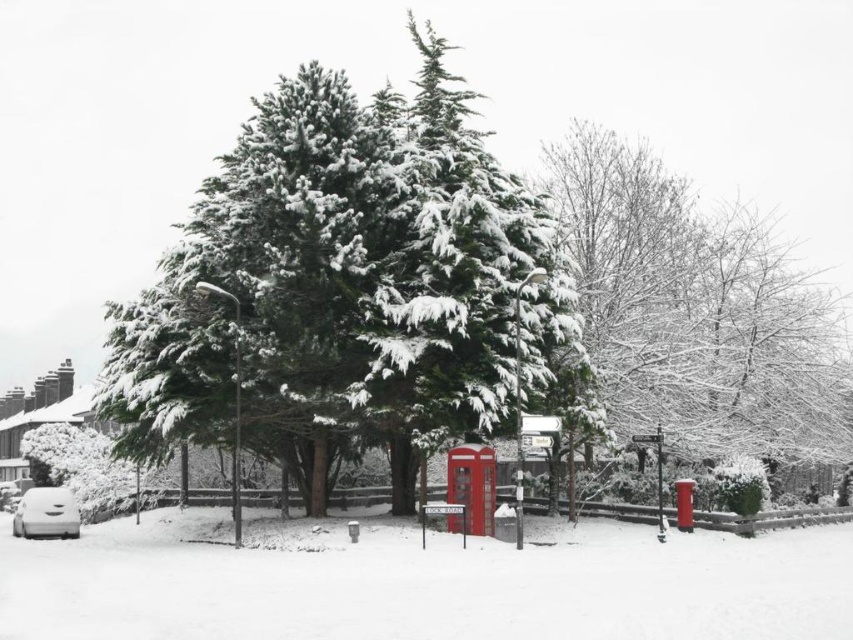
Is green textured tree at center shorter than snow-covered evergreen tree at center?

Indeed, green textured tree at center has a lesser height compared to snow-covered evergreen tree at center.

Between green textured tree at center and snow-covered evergreen tree at center, which one appears on the right side from the viewer's perspective?

Positioned to the right is snow-covered evergreen tree at center.

Identify the location of green textured tree at center. The width and height of the screenshot is (853, 640). (349, 288).

Which of these two, snow-covered evergreen tree at center or metallic red phone box at center, stands taller?

Standing taller between the two is snow-covered evergreen tree at center.

Which is more to the right, snow-covered evergreen tree at center or metallic red phone box at center?

snow-covered evergreen tree at center is more to the right.

Is point (628, 186) closer to viewer compared to point (451, 520)?

That is False.

The height and width of the screenshot is (640, 853). I want to click on snow-covered evergreen tree at center, so click(x=695, y=308).

Measure the distance between white fluffy snow at lower center and camera.

The distance of white fluffy snow at lower center from camera is 30.52 feet.

Who is taller, white fluffy snow at lower center or metallic red phone box at center?

white fluffy snow at lower center is taller.

This screenshot has height=640, width=853. Find the location of `white fluffy snow at lower center`. white fluffy snow at lower center is located at coordinates (428, 586).

What are the coordinates of `white fluffy snow at lower center` in the screenshot? It's located at (428, 586).